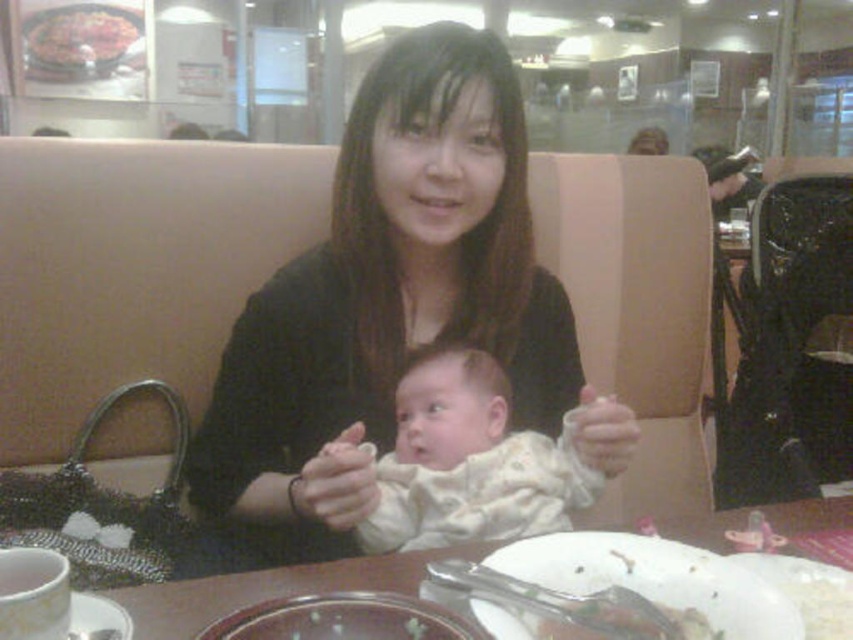
Is point (514, 413) closer to viewer compared to point (381, 502)?

No, it is behind (381, 502).

What are the coordinates of `black matte shirt at center` in the screenshot? It's located at (392, 305).

Can you confirm if white soft baby at center is positioned to the left of white matte plate at lower center?

Yes, white soft baby at center is to the left of white matte plate at lower center.

Does white soft baby at center appear over white matte plate at lower center?

Yes.

The width and height of the screenshot is (853, 640). What do you see at coordinates (468, 461) in the screenshot?
I see `white soft baby at center` at bounding box center [468, 461].

Identify the location of white soft baby at center. This screenshot has width=853, height=640. (468, 461).

Does white soft baby at center appear on the right side of transparent glass plate at center?

Correct, you'll find white soft baby at center to the right of transparent glass plate at center.

Does white soft baby at center lie in front of transparent glass plate at center?

No.

At what (x,y) coordinates should I click in order to perform the action: click on white soft baby at center. Please return your answer as a coordinate pair (x, y). The height and width of the screenshot is (640, 853). Looking at the image, I should click on (468, 461).